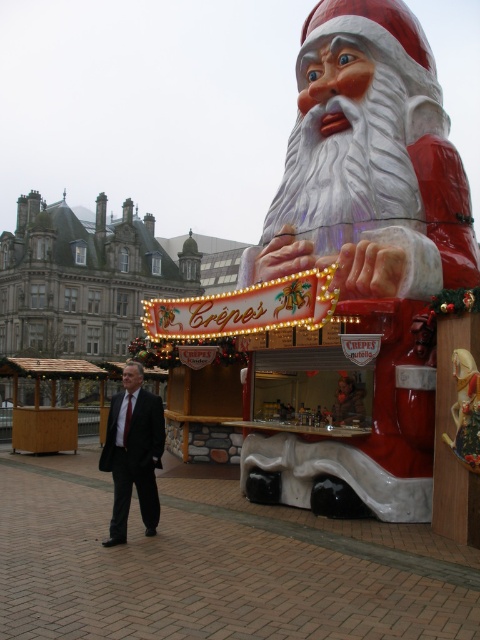
Question: Which of the following is the closest to the observer?

Choices:
 (A) dark suit at center
 (B) matte plastic santa at center

Answer: (A)

Question: Can you confirm if matte plastic santa at center is positioned below dark suit at center?

Choices:
 (A) no
 (B) yes

Answer: (A)

Question: Which object appears farthest from the camera in this image?

Choices:
 (A) matte plastic santa at center
 (B) dark suit at center

Answer: (A)

Question: Which of the following is the closest to the observer?

Choices:
 (A) dark suit at center
 (B) matte plastic santa at center

Answer: (A)

Question: Is matte plastic santa at center wider than dark suit at center?

Choices:
 (A) yes
 (B) no

Answer: (A)

Question: Can you confirm if matte plastic santa at center is positioned to the left of dark suit at center?

Choices:
 (A) yes
 (B) no

Answer: (B)